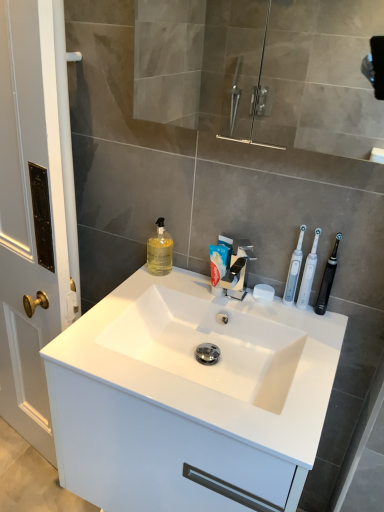
The image size is (384, 512). I want to click on vacant space that's between translucent yellow liquid at sink left and white matte soap at center, so click(197, 284).